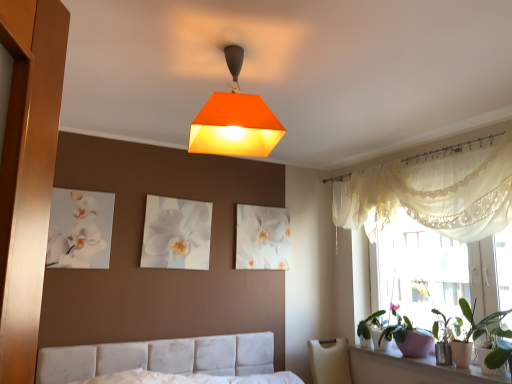
This screenshot has height=384, width=512. Describe the element at coordinates (234, 120) in the screenshot. I see `orange matte lampshade at upper center` at that location.

Locate an element on the screen. Image resolution: width=512 pixels, height=384 pixels. white ceramic window sill at lower right is located at coordinates (410, 369).

Measure the distance between point (389, 203) and camera.

Point (389, 203) and camera are 3.38 meters apart from each other.

Measure the distance between point (468, 321) and camera.

Point (468, 321) and camera are 9.84 feet apart from each other.

Where is `white fabric bed at lower center`? white fabric bed at lower center is located at coordinates (167, 362).

The image size is (512, 384). What do you see at coordinates (433, 193) in the screenshot?
I see `translucent fabric at upper right` at bounding box center [433, 193].

Describe the element at coordinates (176, 233) in the screenshot. This screenshot has height=384, width=512. I see `white glossy canvas at center, which ranks as the 2th picture frame in left-to-right order` at that location.

Find the location of a particular element. The image size is (512, 384). orange matte lampshade at upper center is located at coordinates (234, 120).

Is translucent fabric at upper right oriented towards white fabric bed at lower center?

Yes, translucent fabric at upper right is aimed at white fabric bed at lower center.

Identify the location of bed that appears below the translucent fabric at upper right (from a real-world perspective). (167, 362).

From a real-world perspective, is translucent fabric at upper right located beneath white fabric bed at lower center?

No, from a real-world perspective, translucent fabric at upper right is not beneath white fabric bed at lower center.

Between translucent fabric at upper right and white fabric bed at lower center, which one has larger size?

white fabric bed at lower center is bigger.

Which object is further away from the camera, white lace curtain at upper right or translucent fabric at upper right?

translucent fabric at upper right is further from the camera.

From the picture: In the image, is white lace curtain at upper right on the left side or the right side of translucent fabric at upper right?

white lace curtain at upper right is positioned on translucent fabric at upper right's left side.

Considering the sizes of white lace curtain at upper right and translucent fabric at upper right in the image, is white lace curtain at upper right wider or thinner than translucent fabric at upper right?

Clearly, white lace curtain at upper right has more width compared to translucent fabric at upper right.

This screenshot has height=384, width=512. Identify the location of curtain on the left of the translucent fabric at upper right. (433, 194).

Is white ceramic window sill at lower right bigger than white glossy picture frame at center, the third picture frame in the front-to-back sequence?

Yes, white ceramic window sill at lower right is bigger than white glossy picture frame at center, the third picture frame in the front-to-back sequence.

Can you confirm if white ceramic window sill at lower right is thinner than white glossy picture frame at center, the 1th picture frame in the right-to-left sequence?

No, white ceramic window sill at lower right is not thinner than white glossy picture frame at center, the 1th picture frame in the right-to-left sequence.

Identify the location of window sill below the white glossy picture frame at center, the first picture frame positioned from the back (from the image's perspective). This screenshot has width=512, height=384. (410, 369).

From a real-world perspective, is white ceramic window sill at lower right physically located above or below white glossy picture frame at center, the third picture frame from the left?

From a real-world perspective, white ceramic window sill at lower right is physically below white glossy picture frame at center, the third picture frame from the left.

Does orange matte lampshade at upper center have a larger size compared to white lace curtain at upper right?

No, orange matte lampshade at upper center is not bigger than white lace curtain at upper right.

From the image's perspective, relative to white lace curtain at upper right, is orange matte lampshade at upper center above or below?

From the image's perspective, orange matte lampshade at upper center appears above white lace curtain at upper right.

How distant is orange matte lampshade at upper center from white lace curtain at upper right?

1.57 meters.

Is orange matte lampshade at upper center taller or shorter than white lace curtain at upper right?

orange matte lampshade at upper center is shorter than white lace curtain at upper right.

Looking at this image, who is bigger, green matte plant at right or orange matte lampshade at upper center?

With larger size is orange matte lampshade at upper center.

Find the location of a particular element. lamp above the green matte plant at right (from a real-world perspective) is located at coordinates (234, 120).

Is green matte plant at right inside the boundaries of orange matte lampshade at upper center, or outside?

green matte plant at right is outside orange matte lampshade at upper center.

Between green matte plant at right and orange matte lampshade at upper center, which one appears on the right side from the viewer's perspective?

green matte plant at right is more to the right.

How much distance is there between green matte plant at right and white fabric bed at lower center?

They are 1.67 meters apart.

Could you tell me if green matte plant at right is turned towards white fabric bed at lower center?

Yes.

Is white fabric bed at lower center located within green matte plant at right?

No.

From a real-world perspective, who is located higher, green matte plant at right or white fabric bed at lower center?

From a 3D spatial view, green matte plant at right is above.

Consider the image. Is white ceramic window sill at lower right not close to orange matte lampshade at upper center?

Yes.

In terms of width, does white ceramic window sill at lower right look wider or thinner when compared to orange matte lampshade at upper center?

white ceramic window sill at lower right is thinner than orange matte lampshade at upper center.

Between white ceramic window sill at lower right and orange matte lampshade at upper center, which one is positioned behind?

white ceramic window sill at lower right is behind.

Based on the photo, is white ceramic window sill at lower right turned away from orange matte lampshade at upper center?

white ceramic window sill at lower right is not turned away from orange matte lampshade at upper center.

Where is `bay window above the white fabric bed at lower center (from the image's perspective)`? The height and width of the screenshot is (384, 512). bay window above the white fabric bed at lower center (from the image's perspective) is located at coordinates (433, 193).

What are the coordinates of `curtain above the translucent fabric at upper right (from a real-world perspective)` in the screenshot? It's located at (433, 194).

Which object lies nearer to the anchor point white glossy picture frame at center, the 1th picture frame in the right-to-left sequence, orange matte lampshade at upper center or white glossy canvas at center, which is counted as the 2th picture frame, starting from the right?

white glossy canvas at center, which is counted as the 2th picture frame, starting from the right, is positioned closer to the anchor white glossy picture frame at center, the 1th picture frame in the right-to-left sequence.

Looking at the image, which one is located closer to translucent fabric at upper right, white lace curtain at upper right or white glossy picture frame at center, the 1th picture frame in the right-to-left sequence?

The object closer to translucent fabric at upper right is white lace curtain at upper right.

Looking at the image, which one is located closer to white glossy picture frame at center, the third picture frame from the left, translucent fabric at upper right or white fabric bed at lower center?

white fabric bed at lower center is closer to white glossy picture frame at center, the third picture frame from the left.

From the image, which object appears to be nearer to white glossy canvas at upper left, which is counted as the first picture frame, starting from the left, white glossy picture frame at center, the third picture frame in the front-to-back sequence, or white lace curtain at upper right?

white glossy picture frame at center, the third picture frame in the front-to-back sequence, is positioned closer to the anchor white glossy canvas at upper left, which is counted as the first picture frame, starting from the left.

From the image, which object appears to be nearer to orange matte lampshade at upper center, white lace curtain at upper right or white glossy canvas at center, acting as the 2th picture frame starting from the back?

white glossy canvas at center, acting as the 2th picture frame starting from the back.

Considering their positions, is white glossy canvas at upper left, placed as the 1th picture frame when sorted from front to back, positioned further to white lace curtain at upper right than white glossy picture frame at center, the third picture frame in the front-to-back sequence?

white glossy canvas at upper left, placed as the 1th picture frame when sorted from front to back.

Considering their positions, is white ceramic window sill at lower right positioned closer to green matte plant at right than white glossy picture frame at center, the 1th picture frame in the right-to-left sequence?

Based on the image, white ceramic window sill at lower right appears to be nearer to green matte plant at right.

Estimate the real-world distances between objects in this image. Which object is closer to orange matte lampshade at upper center, white glossy canvas at upper left, which is counted as the first picture frame, starting from the left, or white fabric bed at lower center?

The object closer to orange matte lampshade at upper center is white glossy canvas at upper left, which is counted as the first picture frame, starting from the left.

Locate an element on the screen. Image resolution: width=512 pixels, height=384 pixels. bay window between white lace curtain at upper right and green matte plant at right vertically is located at coordinates (433, 193).

Identify the location of houseplant located between orange matte lampshade at upper center and white glossy picture frame at center, the 1th picture frame in the right-to-left sequence, in the depth direction. This screenshot has width=512, height=384. (473, 324).

At what (x,y) coordinates should I click in order to perform the action: click on window sill between white glossy picture frame at center, the third picture frame from the left, and translucent fabric at upper right, in the horizontal direction. Please return your answer as a coordinate pair (x, y). The image size is (512, 384). Looking at the image, I should click on (410, 369).

Where is `houseplant between translucent fabric at upper right and white ceramic window sill at lower right from top to bottom`? houseplant between translucent fabric at upper right and white ceramic window sill at lower right from top to bottom is located at coordinates (473, 324).